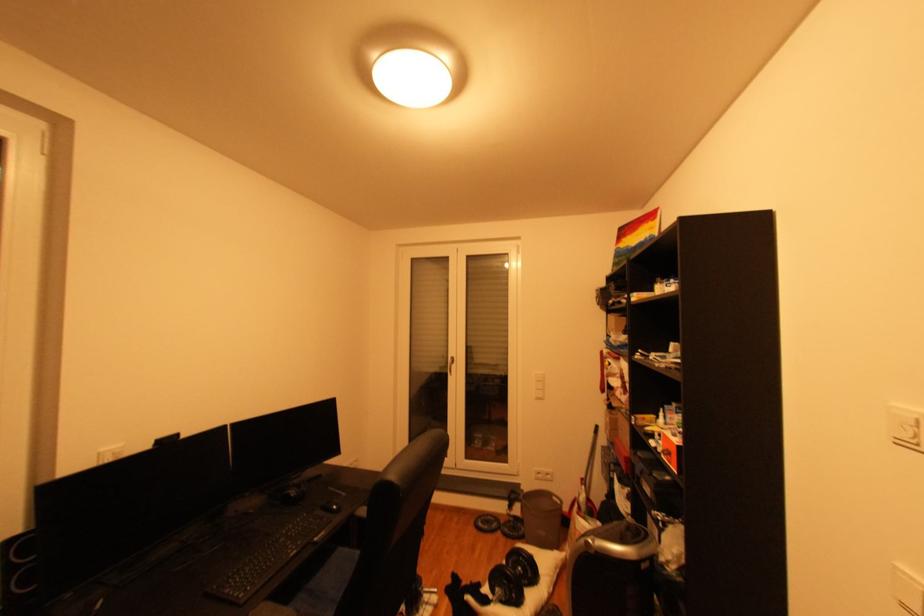
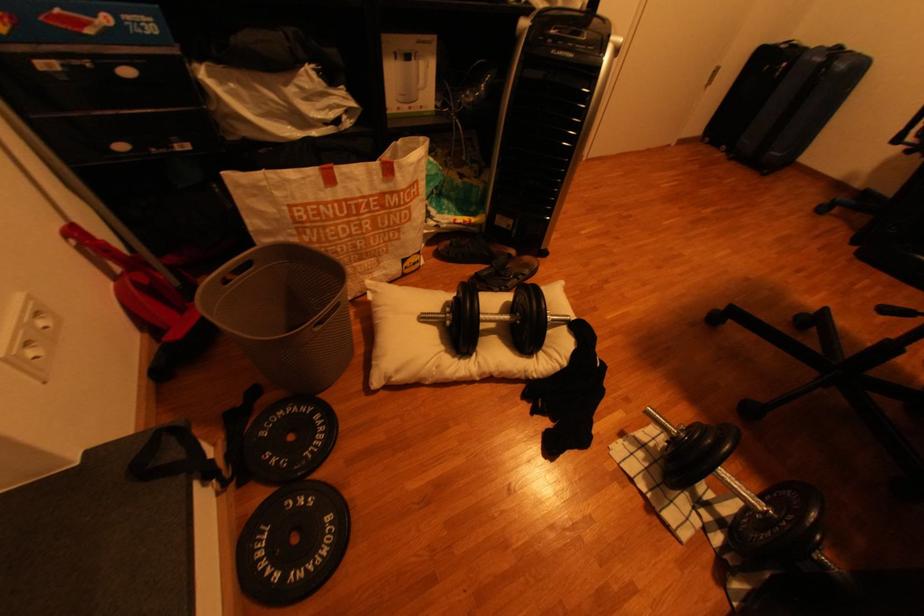
Where in the second image is the point corresponding to (527,535) from the first image?

(325, 419)